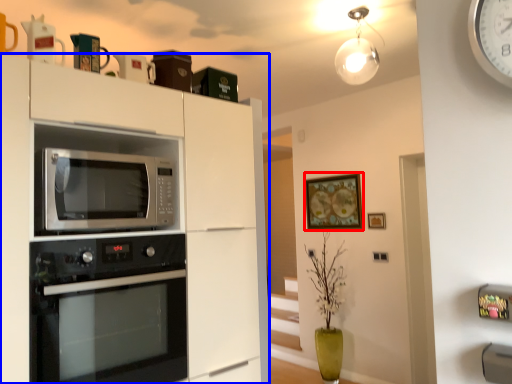
Question: Which of the following is the farthest to the observer, picture frame (highlighted by a red box) or cabinetry (highlighted by a blue box)?

Choices:
 (A) picture frame
 (B) cabinetry

Answer: (A)